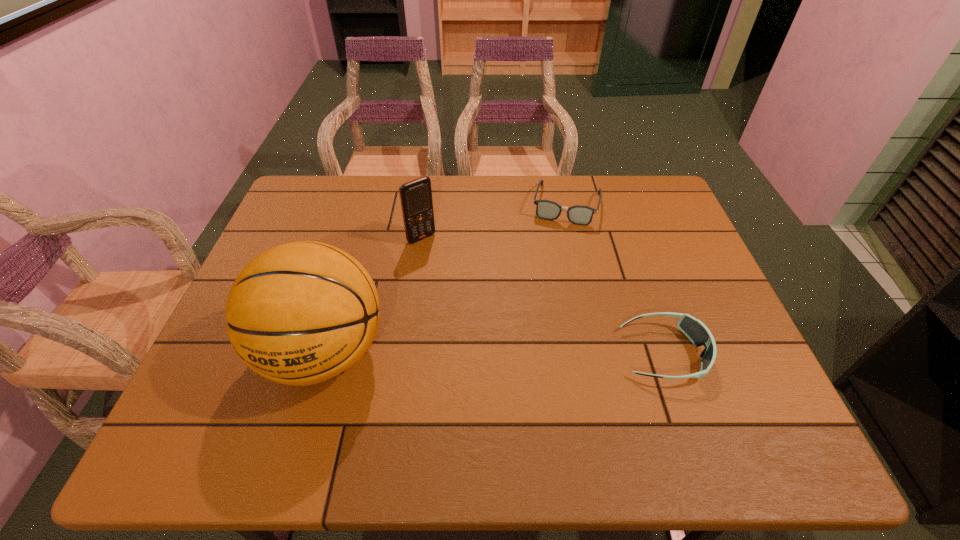
Find the location of a particular element. vacant spot on the desktop that is between the basketball and the goggles and is positioned on the screen of the third shortest object is located at coordinates (528, 353).

Locate an element on the screen. The image size is (960, 540). free space on the desktop that is between the tallest object and the goggles and is positioned on the face of the spectacles is located at coordinates point(533,353).